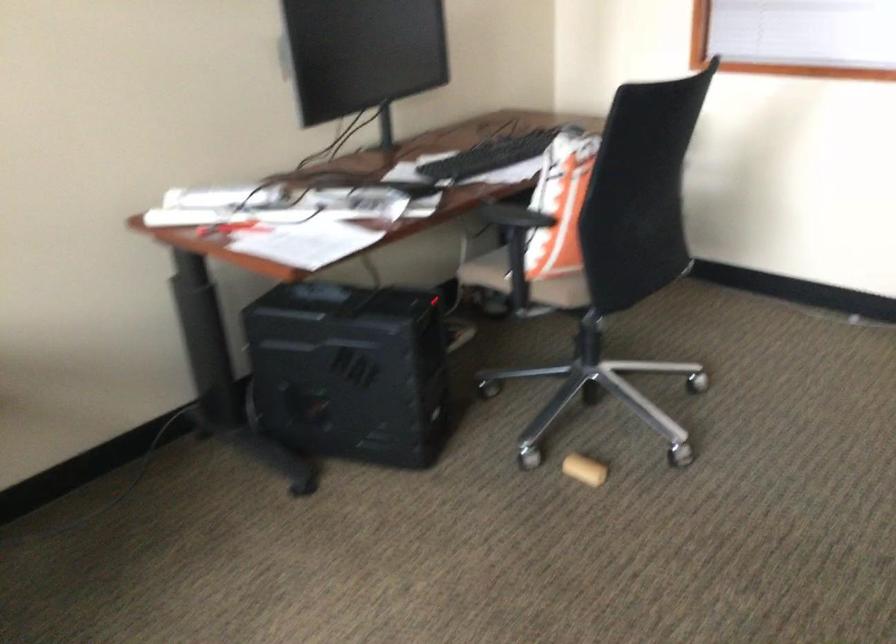
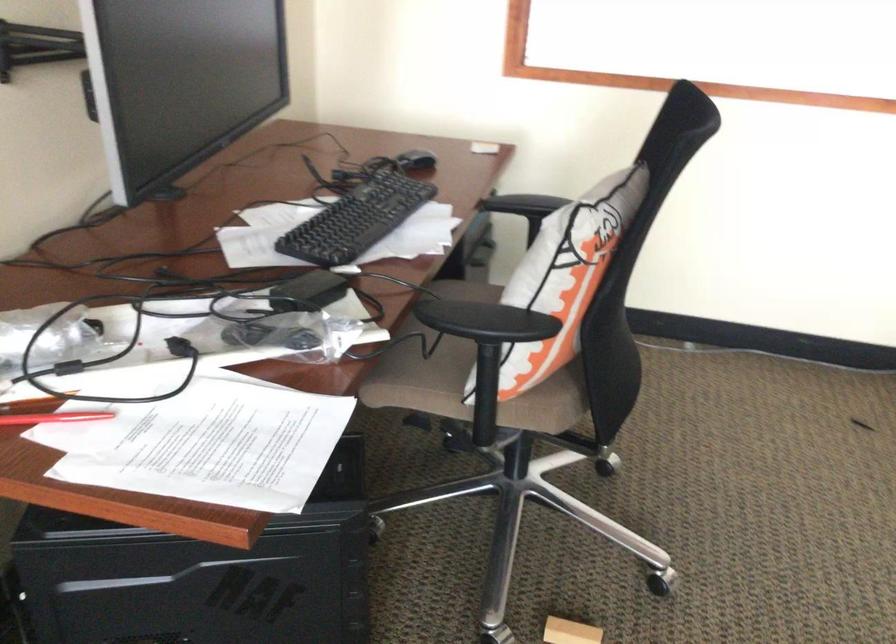
Find the pixel in the second image that matches pixel 558 286 in the first image.

(543, 408)